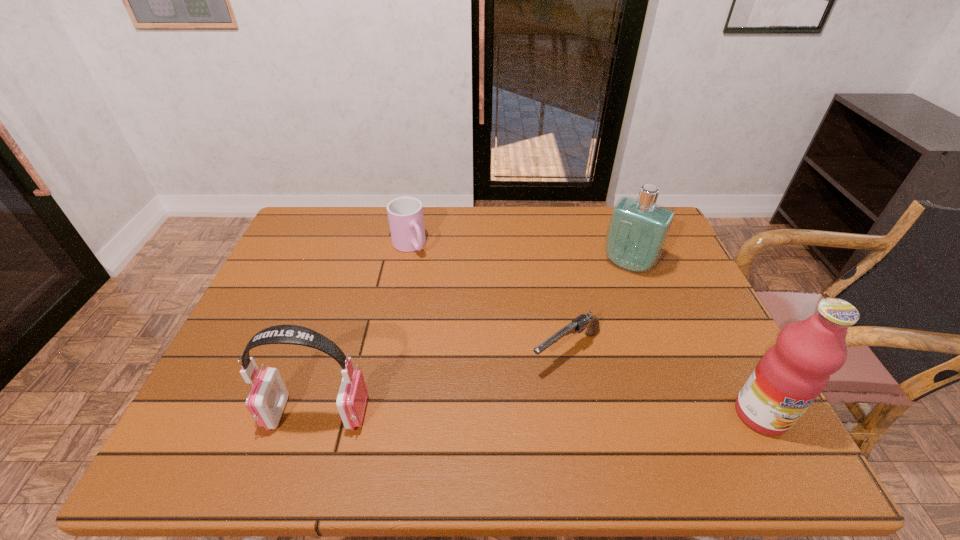
The width and height of the screenshot is (960, 540). Find the location of `free space at the near edge of the desktop`. free space at the near edge of the desktop is located at coordinates (670, 418).

At what (x,y) coordinates should I click in order to perform the action: click on vacant region at the left edge of the desktop. Please return your answer as a coordinate pair (x, y). The image size is (960, 540). Looking at the image, I should click on (257, 302).

Find the location of a particular element. This screenshot has width=960, height=540. free space at the right edge of the desktop is located at coordinates (668, 300).

What are the coordinates of `free point between the earphone and the second object from right to left` in the screenshot? It's located at (473, 339).

You are a GUI agent. You are given a task and a screenshot of the screen. Output one action in this format:
    pyautogui.click(x=<x>, y=<y>)
    Task: Click on the vacant area that lies between the fruit juice and the cup
    
    Given the screenshot: What is the action you would take?
    coord(585,330)

Where is `free space between the second object from right to left and the fruit juice`? free space between the second object from right to left and the fruit juice is located at coordinates (695, 339).

Where is `free space between the cup and the fourth object from left to right`? This screenshot has width=960, height=540. free space between the cup and the fourth object from left to right is located at coordinates point(519,255).

What are the coordinates of `empty location between the third farthest object and the perfume` in the screenshot? It's located at (597, 308).

Identify the location of vacant area that lies between the gun and the fourth tallest object. This screenshot has height=540, width=960. (488, 299).

Identify the location of empty space that is in between the tallest object and the perfume. (695, 339).